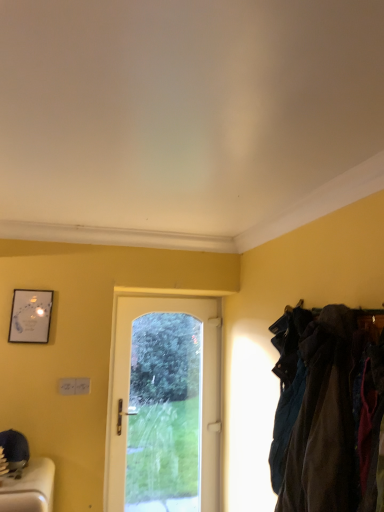
What is the approximate height of dark blue fabric at right?

dark blue fabric at right is 30.65 inches in height.

This screenshot has width=384, height=512. What are the coordinates of `matte silver picture frame at upper left` in the screenshot? It's located at (30, 316).

From a real-world perspective, is matte silver picture frame at upper left above or below white glass door at center?

matte silver picture frame at upper left is situated higher than white glass door at center in the real world.

Looking at this image, would you say matte silver picture frame at upper left is a long distance from white glass door at center?

matte silver picture frame at upper left is positioned a significant distance from white glass door at center.

Is matte silver picture frame at upper left taller than white glass door at center?

In fact, matte silver picture frame at upper left may be shorter than white glass door at center.

At what (x,y) coordinates should I click in order to perform the action: click on door below the matte silver picture frame at upper left (from the image's perspective). Please return your answer as a coordinate pair (x, y). The width and height of the screenshot is (384, 512). Looking at the image, I should click on [x=165, y=405].

Based on the photo, does white glass door at center have a lesser width compared to dark blue fabric at right?

Indeed, white glass door at center has a lesser width compared to dark blue fabric at right.

Does white glass door at center contain dark blue fabric at right?

That's incorrect, dark blue fabric at right is not inside white glass door at center.

The image size is (384, 512). In order to click on door that appears behind the dark blue fabric at right in this screenshot , I will do `click(165, 405)`.

Considering the sizes of white glass door at center and dark blue fabric at right in the image, is white glass door at center bigger or smaller than dark blue fabric at right?

white glass door at center is bigger than dark blue fabric at right.

Is point (47, 290) farther from camera compared to point (281, 483)?

That is True.

Is matte silver picture frame at upper left directly adjacent to dark blue fabric at right?

No, matte silver picture frame at upper left is not with dark blue fabric at right.

Can you confirm if matte silver picture frame at upper left is thinner than dark blue fabric at right?

Correct, the width of matte silver picture frame at upper left is less than that of dark blue fabric at right.

Between matte silver picture frame at upper left and dark blue fabric at right, which one has larger size?

dark blue fabric at right.

Is dark blue fabric at right taller or shorter than white glass door at center?

In the image, dark blue fabric at right appears to be shorter than white glass door at center.

Find the location of a particular element. This screenshot has height=512, width=384. door on the left side of dark blue fabric at right is located at coordinates (165, 405).

Is white glass door at center at the back of dark blue fabric at right?

That's not correct — dark blue fabric at right is not looking away from white glass door at center.

Which is in front, dark blue fabric at right or white glass door at center?

Positioned in front is dark blue fabric at right.

Are white glass door at center and matte silver picture frame at upper left far apart?

That's right, there is a large distance between white glass door at center and matte silver picture frame at upper left.

Is white glass door at center to the left or to the right of matte silver picture frame at upper left in the image?

white glass door at center is to the right of matte silver picture frame at upper left.

From a real-world perspective, which is physically above, white glass door at center or matte silver picture frame at upper left?

matte silver picture frame at upper left.

Who is taller, dark blue fabric at right or matte silver picture frame at upper left?

Standing taller between the two is dark blue fabric at right.

Considering the relative positions of dark blue fabric at right and matte silver picture frame at upper left in the image provided, is dark blue fabric at right to the right of matte silver picture frame at upper left from the viewer's perspective?

Yes, dark blue fabric at right is to the right of matte silver picture frame at upper left.

From the image's perspective, which object appears higher, dark blue fabric at right or matte silver picture frame at upper left?

matte silver picture frame at upper left, from the image's perspective.

You are a GUI agent. You are given a task and a screenshot of the screen. Output one action in this format:
    pyautogui.click(x=<x>, y=<y>)
    Task: Click on the picture frame that appears behind the dark blue fabric at right
    
    Given the screenshot: What is the action you would take?
    pyautogui.click(x=30, y=316)

You are a GUI agent. You are given a task and a screenshot of the screen. Output one action in this format:
    pyautogui.click(x=<x>, y=<y>)
    Task: Click on the picture frame on the left of white glass door at center
    The height and width of the screenshot is (512, 384).
    Given the screenshot: What is the action you would take?
    pyautogui.click(x=30, y=316)

Find the location of a particular element. The height and width of the screenshot is (512, 384). laundry that appears in front of the white glass door at center is located at coordinates (327, 411).

Which object lies further to the anchor point white glass door at center, dark blue fabric at right or matte silver picture frame at upper left?

Among the two, dark blue fabric at right is located further to white glass door at center.

Consider the image. Based on their spatial positions, is dark blue fabric at right or white glass door at center further from matte silver picture frame at upper left?

Among the two, dark blue fabric at right is located further to matte silver picture frame at upper left.

From the image, which object appears to be nearer to dark blue fabric at right, matte silver picture frame at upper left or white glass door at center?

white glass door at center.

Estimate the real-world distances between objects in this image. Which object is closer to dark blue fabric at right, white glass door at center or matte silver picture frame at upper left?

Based on the image, white glass door at center appears to be nearer to dark blue fabric at right.

Which object lies nearer to the anchor point matte silver picture frame at upper left, white glass door at center or dark blue fabric at right?

white glass door at center is closer to matte silver picture frame at upper left.

Estimate the real-world distances between objects in this image. Which object is further from white glass door at center, matte silver picture frame at upper left or dark blue fabric at right?

dark blue fabric at right.

I want to click on picture frame positioned between dark blue fabric at right and white glass door at center from near to far, so click(x=30, y=316).